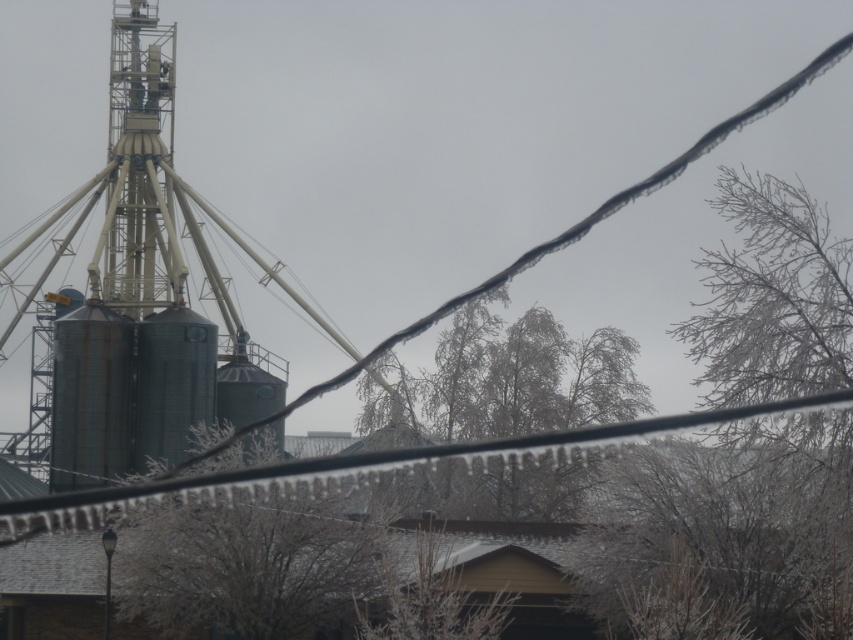
Question: Is snow-covered branches at center wider than brown wood tree at center?

Choices:
 (A) no
 (B) yes

Answer: (B)

Question: Which of the following is the closest to the observer?

Choices:
 (A) (502, 323)
 (B) (212, 584)

Answer: (B)

Question: Does brown textured tree at center have a larger size compared to snow-covered branches at center?

Choices:
 (A) no
 (B) yes

Answer: (A)

Question: Is brown textured tree at center positioned in front of brown wood tree at center?

Choices:
 (A) no
 (B) yes

Answer: (A)

Question: Which point is farther to the camera?

Choices:
 (A) brown wood tree at center
 (B) brown textured tree at center
 (C) snow-covered branches at center

Answer: (C)

Question: Based on their relative distances, which object is farther from the brown wood tree at center?

Choices:
 (A) brown textured tree at center
 (B) snow-covered branches at center

Answer: (B)